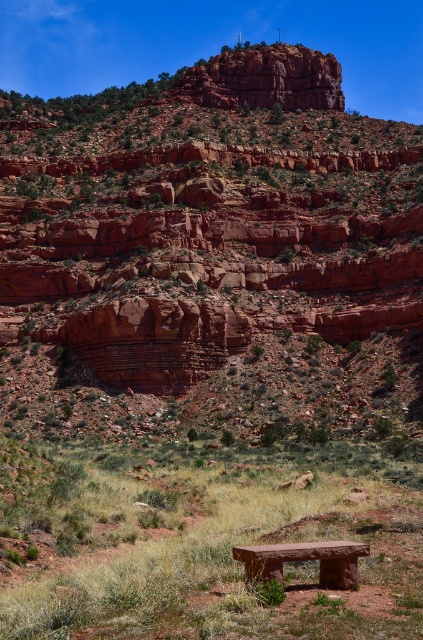
Question: Which object appears farthest from the camera in this image?

Choices:
 (A) smooth stone bench at center
 (B) brown stone bench at center

Answer: (A)

Question: In this image, where is brown stone bench at center located relative to smooth stone bench at center?

Choices:
 (A) left
 (B) right

Answer: (A)

Question: Is brown stone bench at center above smooth stone bench at center?

Choices:
 (A) no
 (B) yes

Answer: (A)

Question: Can you confirm if brown stone bench at center is bigger than smooth stone bench at center?

Choices:
 (A) no
 (B) yes

Answer: (B)

Question: Which point is farther from the camera taking this photo?

Choices:
 (A) (236, 502)
 (B) (329, 584)

Answer: (A)